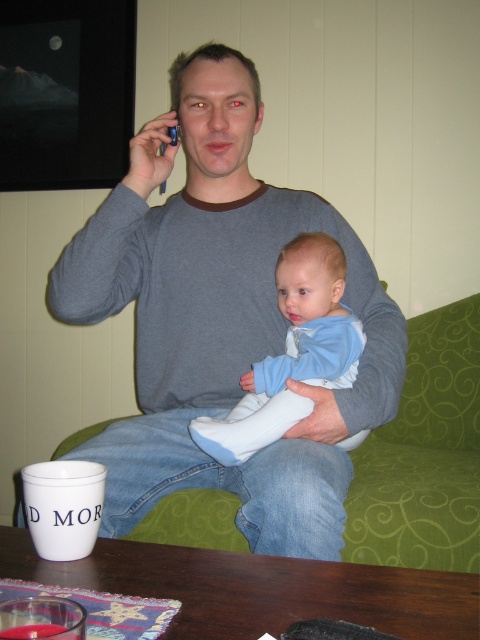
You are a photographer setting up for a family portrait. You need to ensure that the gray cotton sweater at center and the light blue fabric baby at center are both visible in the frame. Given their sizes, which object should you focus on to ensure the baby is fully visible without cropping?

The gray cotton sweater at center has a greater height compared to the light blue fabric baby at center. To ensure the baby is fully visible without cropping, focus on the gray cotton sweater at center as it is taller, allowing the baby to fit within the frame.

You are standing in front of the scene and want to determine which of the two points, point (236,83) or point (319,364), is closer to you. Based on the image, which point is nearer?

Point (236,83) is further to the viewer than point (319,364), so point (319,364) is closer to you.